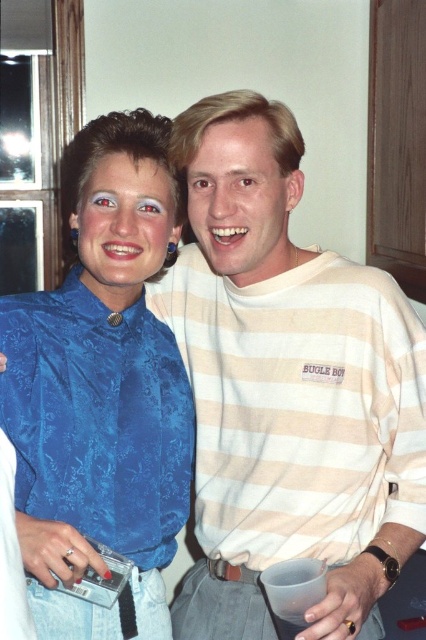
Does matte beige shirt at center come behind matte blue blouse at upper left?

No.

Who is higher up, matte beige shirt at center or matte blue blouse at upper left?

matte beige shirt at center is above.

The height and width of the screenshot is (640, 426). Identify the location of matte beige shirt at center. (241, 202).

Between blue satin blouse at left and matte beige shirt at center, which one appears on the left side from the viewer's perspective?

From the viewer's perspective, blue satin blouse at left appears more on the left side.

Is point (19, 307) positioned before point (187, 170)?

Yes, it is in front of point (187, 170).

The width and height of the screenshot is (426, 640). I want to click on blue satin blouse at left, so click(101, 388).

Does point (80, 461) come behind point (88, 227)?

No, (80, 461) is closer to viewer.

Measure the distance between blue satin blouse at left and matte blue blouse at upper left.

blue satin blouse at left is 13.51 centimeters away from matte blue blouse at upper left.

Where is `blue satin blouse at left`? This screenshot has height=640, width=426. blue satin blouse at left is located at coordinates (101, 388).